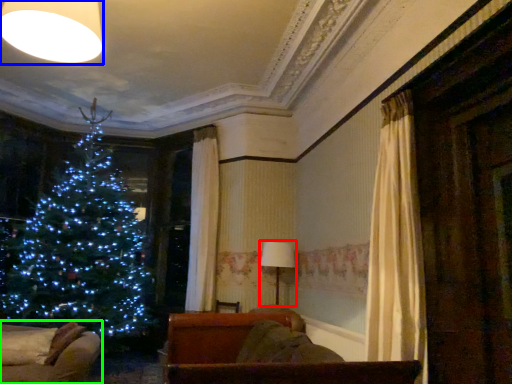
Question: Based on their relative distances, which object is nearer to lamp (highlighted by a red box)? Choose from lighting (highlighted by a blue box) and furniture (highlighted by a green box).

Choices:
 (A) lighting
 (B) furniture

Answer: (B)